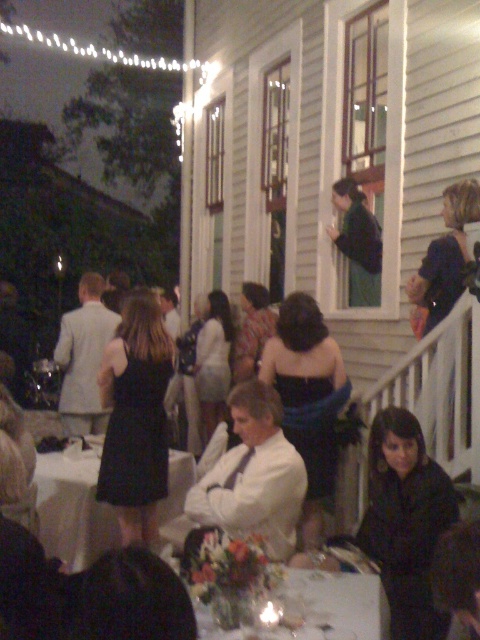
You are a photographer at this evening event. You want to capture a photo of the black matte dress at lower right and the white glossy table at center. Which object should you focus on first if you need to adjust the focus based on their heights?

The black matte dress at lower right is taller than the white glossy table at center, so you should focus on the black matte dress at lower right first since it is taller.

You are a photographer at the wedding reception and need to capture a photo of the black matte dress at lower right without including the white railing in the background. Where should you position yourself relative to the dress to avoid the railing?

To avoid including the white railing in the background, position yourself to the left of the black matte dress at lower right since the railing is located at the upper part of the porch, and the dress is positioned lower right at coordinates (406, 522).